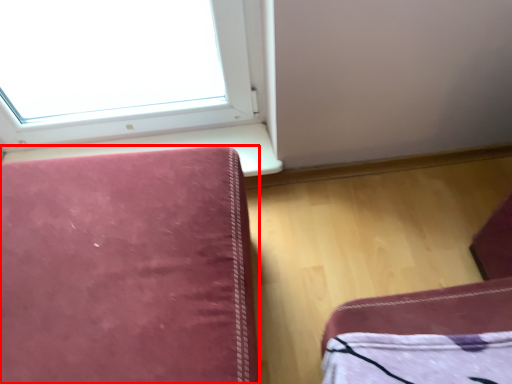
Question: From the image's perspective, what is the correct spatial relationship of furniture (annotated by the red box) in relation to window sill?

Choices:
 (A) below
 (B) above

Answer: (A)